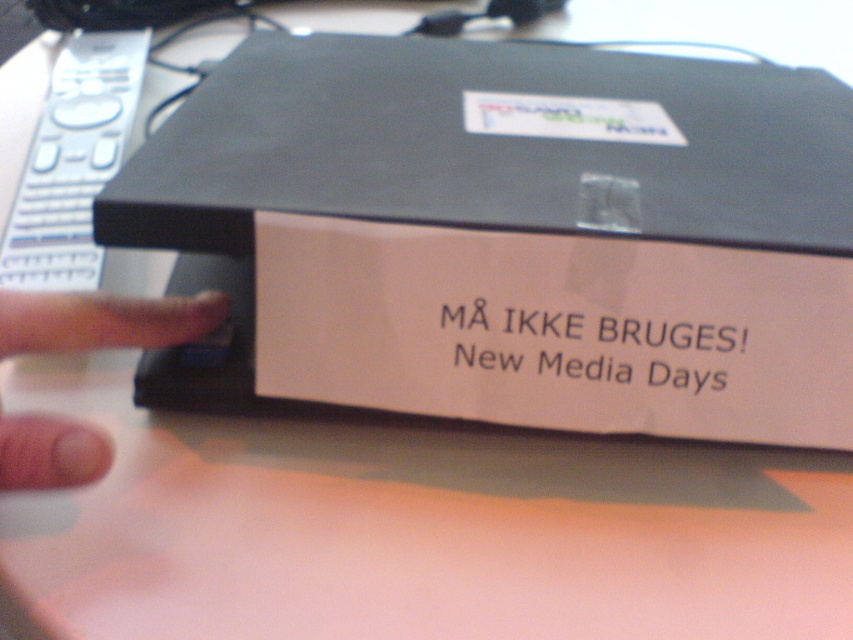
Question: From the image, what is the correct spatial relationship of white plastic remote at upper left in relation to flesh-toned skin at lower left?

Choices:
 (A) right
 (B) left

Answer: (B)

Question: Which point is closer to the camera?

Choices:
 (A) white plastic remote at upper left
 (B) flesh-toned skin at lower left

Answer: (B)

Question: Observing the image, what is the correct spatial positioning of white plastic remote at upper left in reference to flesh-toned skin at lower left?

Choices:
 (A) right
 (B) left

Answer: (B)

Question: Which of the following is the closest to the observer?

Choices:
 (A) (26, 413)
 (B) (120, 108)

Answer: (A)

Question: Is white plastic remote at upper left in front of flesh-toned skin at lower left?

Choices:
 (A) yes
 (B) no

Answer: (B)

Question: Which of the following is the closest to the observer?

Choices:
 (A) (102, 140)
 (B) (160, 310)

Answer: (B)